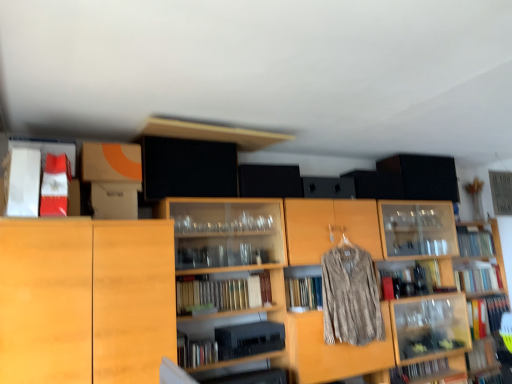
This screenshot has width=512, height=384. What do you see at coordinates (55, 186) in the screenshot?
I see `matte red book at upper left, which ranks as the sixth book in bottom-to-top order` at bounding box center [55, 186].

Image resolution: width=512 pixels, height=384 pixels. Identify the location of hardcover book at upper right, which ranks as the first book in back-to-front order. (474, 242).

Measure the distance between hardcover book at lower right, which ranks as the third book in back-to-front order, and camera.

3.67 meters.

The image size is (512, 384). I want to click on hardcover book at lower right, acting as the fourth book starting from the left, so click(478, 277).

Describe the element at coordinates (284, 282) in the screenshot. I see `wooden bookshelf at center, the 2th shelf from the right` at that location.

What do you see at coordinates (482, 297) in the screenshot? This screenshot has width=512, height=384. I see `clear glass shelves at upper right, arranged as the 1th shelf when viewed from the right` at bounding box center [482, 297].

What is the approximate height of hardcover books at center, placed as the 2th book when sorted from front to back?

7.59 inches.

Locate an element on the screen. The height and width of the screenshot is (384, 512). hardcover book at lower right, which is the third book in left-to-right order is located at coordinates (418, 371).

Locate an element on the screen. clothing on the left side of clear glass shelves at upper right, the second shelf from the left is located at coordinates (350, 297).

Looking at this image, who is shorter, textured beige shirt at center or clear glass shelves at upper right, arranged as the 1th shelf when viewed from the right?

textured beige shirt at center.

From the picture: Does textured beige shirt at center have a greater width compared to clear glass shelves at upper right, the second shelf from the left?

No, textured beige shirt at center is not wider than clear glass shelves at upper right, the second shelf from the left.

Do you think textured beige shirt at center is within clear glass shelves at upper right, arranged as the 1th shelf when viewed from the right, or outside of it?

textured beige shirt at center is spatially situated outside clear glass shelves at upper right, arranged as the 1th shelf when viewed from the right.

Is hardcover books at center, the 2th book in the left-to-right sequence, a part of clear glass shelves at upper right, the second shelf from the left?

No.

Does clear glass shelves at upper right, the second shelf from the left, turn towards hardcover books at center, marked as the 5th book in a right-to-left arrangement?

No, clear glass shelves at upper right, the second shelf from the left, is not turned towards hardcover books at center, marked as the 5th book in a right-to-left arrangement.

From a real-world perspective, is clear glass shelves at upper right, arranged as the 1th shelf when viewed from the right, physically located above or below hardcover books at center, the 2th book in the left-to-right sequence?

clear glass shelves at upper right, arranged as the 1th shelf when viewed from the right, is situated lower than hardcover books at center, the 2th book in the left-to-right sequence, in the real world.

How many degrees apart are the facing directions of clear glass shelves at upper right, the second shelf from the left, and hardcover books at center, marked as the 4th book in a bottom-to-top arrangement?

0.989 degrees separate the facing orientations of clear glass shelves at upper right, the second shelf from the left, and hardcover books at center, marked as the 4th book in a bottom-to-top arrangement.

Based on the photo, is wooden bookshelf at center, the first shelf from the left, at the back of hardcover book at lower right, which is counted as the 4th book, starting from the top?

No, hardcover book at lower right, which is counted as the 4th book, starting from the top, is not facing away from wooden bookshelf at center, the first shelf from the left.

In terms of width, does hardcover book at lower right, acting as the fourth book starting from the left, look wider or thinner when compared to wooden bookshelf at center, the first shelf from the left?

In the image, hardcover book at lower right, acting as the fourth book starting from the left, appears to be more narrow than wooden bookshelf at center, the first shelf from the left.

Do you think hardcover book at lower right, which is counted as the 4th book, starting from the top, is within wooden bookshelf at center, the first shelf from the left, or outside of it?

hardcover book at lower right, which is counted as the 4th book, starting from the top, is located beyond the bounds of wooden bookshelf at center, the first shelf from the left.

Between hardcover book at lower right, which is counted as the third book, starting from the bottom, and wooden bookshelf at center, the 2th shelf from the right, which one is positioned in front?

wooden bookshelf at center, the 2th shelf from the right, is more forward.

Which is more to the left, light wood cabinet at left or hardcover book at upper right, the 5th book viewed from the left?

From the viewer's perspective, light wood cabinet at left appears more on the left side.

Is point (58, 318) positioned behind point (490, 253)?

No, (58, 318) is closer to viewer.

Locate an element on the screen. cabinetry located below the hardcover book at upper right, which is counted as the fifth book, starting from the bottom (from the image's perspective) is located at coordinates (86, 301).

Could you tell me if light wood cabinet at left is facing hardcover book at upper right, which is the 2th book in right-to-left order?

No, light wood cabinet at left is not facing towards hardcover book at upper right, which is the 2th book in right-to-left order.

Is hardcover book at lower right, which ranks as the 3th book in right-to-left order, situated inside clear glass shelves at upper right, arranged as the 1th shelf when viewed from the right, or outside?

hardcover book at lower right, which ranks as the 3th book in right-to-left order, exists entirely within clear glass shelves at upper right, arranged as the 1th shelf when viewed from the right.

Consider the image. Is hardcover book at lower right, which ranks as the third book in back-to-front order, aimed at clear glass shelves at upper right, the second shelf from the left?

Yes, hardcover book at lower right, which ranks as the third book in back-to-front order, is aimed at clear glass shelves at upper right, the second shelf from the left.

Which of these two, hardcover book at lower right, arranged as the 4th book when viewed from the front, or clear glass shelves at upper right, the second shelf from the left, is wider?

With larger width is clear glass shelves at upper right, the second shelf from the left.

From the image's perspective, starting from the clear glass shelves at upper right, the second shelf from the left, which book is the 1st one above? Please provide its 2D coordinates.

[(478, 277)]

Can you tell me how much hardcover book at lower right, which ranks as the third book in back-to-front order, and textured beige shirt at center differ in facing direction?

The angular difference between hardcover book at lower right, which ranks as the third book in back-to-front order, and textured beige shirt at center is 2.7 degrees.

Is hardcover book at lower right, which ranks as the third book in back-to-front order, to the left of textured beige shirt at center from the viewer's perspective?

In fact, hardcover book at lower right, which ranks as the third book in back-to-front order, is to the right of textured beige shirt at center.

Which of these two, hardcover book at lower right, arranged as the 4th book when viewed from the front, or textured beige shirt at center, stands shorter?

hardcover book at lower right, arranged as the 4th book when viewed from the front.

Is point (454, 272) in front of point (350, 321)?

No, (454, 272) is further to viewer.

How many degrees apart are the facing directions of wooden bookshelf at center, the first shelf from the left, and clear glass shelves at upper right, the second shelf from the left?

The angular difference between wooden bookshelf at center, the first shelf from the left, and clear glass shelves at upper right, the second shelf from the left, is 0.000138 degrees.

Is wooden bookshelf at center, the 2th shelf from the right, to the right of clear glass shelves at upper right, arranged as the 1th shelf when viewed from the right, from the viewer's perspective?

No.

Based on the photo, who is shorter, wooden bookshelf at center, the first shelf from the left, or clear glass shelves at upper right, the second shelf from the left?

With less height is wooden bookshelf at center, the first shelf from the left.

Does point (452, 279) appear closer or farther from the camera than point (465, 224)?

Point (452, 279).

Find the location of `clothing that appears above the clear glass shelves at upper right, the second shelf from the left (from the image's perspective)`. clothing that appears above the clear glass shelves at upper right, the second shelf from the left (from the image's perspective) is located at coordinates (350, 297).

Where is `the 2nd shelf to the right of the hardcover books at center, positioned as the 3th book in top-to-bottom order, counting from the anchor's position`? Image resolution: width=512 pixels, height=384 pixels. the 2nd shelf to the right of the hardcover books at center, positioned as the 3th book in top-to-bottom order, counting from the anchor's position is located at coordinates (482, 297).

Estimate the real-world distances between objects in this image. Which object is closer to wooden bookshelf at center, the first shelf from the left, light wood cabinet at left or hardcover book at lower right, which is counted as the third book, starting from the bottom?

The object closer to wooden bookshelf at center, the first shelf from the left, is light wood cabinet at left.

Considering their positions, is light wood cabinet at left positioned further to matte red book at upper left, which is the 6th book in right-to-left order, than hardcover books at center, positioned as the 3th book in top-to-bottom order?

hardcover books at center, positioned as the 3th book in top-to-bottom order.

When comparing their distances from matte red book at upper left, which is the 6th book in right-to-left order, does hardcover book at lower right, placed as the 6th book when sorted from top to bottom, or light wood cabinet at left seem closer?

light wood cabinet at left is closer to matte red book at upper left, which is the 6th book in right-to-left order.

Consider the image. When comparing their distances from light wood cabinet at left, does hardcover book at right, positioned as the fifth book in top-to-bottom order, or textured beige shirt at center seem closer?

textured beige shirt at center.

Looking at the image, which one is located closer to hardcover book at upper right, the 5th book viewed from the left, hardcover book at right, positioned as the fifth book in top-to-bottom order, or clear glass shelves at upper right, the second shelf from the left?

The object closer to hardcover book at upper right, the 5th book viewed from the left, is clear glass shelves at upper right, the second shelf from the left.

From the image, which object appears to be farther from textured beige shirt at center, clear glass shelves at upper right, arranged as the 1th shelf when viewed from the right, or matte red book at upper left, which ranks as the sixth book in bottom-to-top order?

matte red book at upper left, which ranks as the sixth book in bottom-to-top order, is positioned further to the anchor textured beige shirt at center.

Estimate the real-world distances between objects in this image. Which object is closer to hardcover book at lower right, acting as the fourth book starting from the left, hardcover book at lower right, marked as the fourth book in a back-to-front arrangement, or matte red book at upper left, which ranks as the sixth book in bottom-to-top order?

hardcover book at lower right, marked as the fourth book in a back-to-front arrangement, lies closer to hardcover book at lower right, acting as the fourth book starting from the left, than the other object.

Estimate the real-world distances between objects in this image. Which object is closer to hardcover book at lower right, arranged as the 4th book when viewed from the front, light wood cabinet at left or clear glass shelves at upper right, the second shelf from the left?

clear glass shelves at upper right, the second shelf from the left, lies closer to hardcover book at lower right, arranged as the 4th book when viewed from the front, than the other object.

Locate an element on the screen. cabinetry situated between matte red book at upper left, arranged as the sixth book when viewed from the back, and textured beige shirt at center from left to right is located at coordinates (86, 301).

The width and height of the screenshot is (512, 384). I want to click on clothing situated between wooden bookshelf at center, the first shelf from the left, and clear glass shelves at upper right, the second shelf from the left, from left to right, so click(x=350, y=297).

Locate an element on the screen. This screenshot has height=384, width=512. clothing between wooden bookshelf at center, the first shelf from the left, and hardcover book at right, the fifth book viewed from the front is located at coordinates (350, 297).

Locate an element on the screen. The width and height of the screenshot is (512, 384). clothing between wooden bookshelf at center, the first shelf from the left, and hardcover book at lower right, marked as the fourth book in a back-to-front arrangement, from front to back is located at coordinates (350, 297).